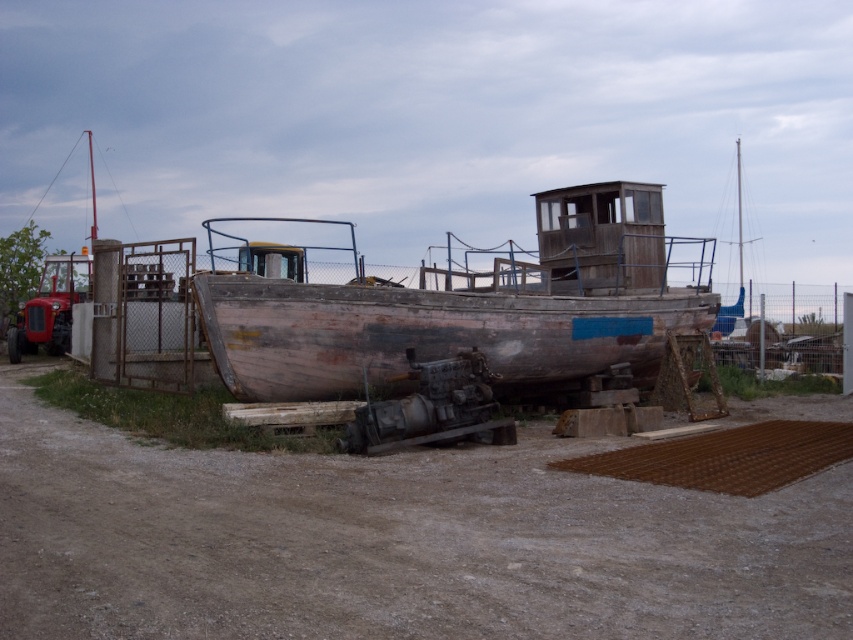
Question: Is brown dirt track at center below rusty wood boat at center?

Choices:
 (A) yes
 (B) no

Answer: (A)

Question: Is brown dirt track at center smaller than rusty wood boat at center?

Choices:
 (A) no
 (B) yes

Answer: (B)

Question: Is brown dirt track at center below rusty wood boat at center?

Choices:
 (A) yes
 (B) no

Answer: (A)

Question: Which point is closer to the camera?

Choices:
 (A) brown dirt track at center
 (B) rusty wood boat at center

Answer: (A)

Question: Which object is closer to the camera taking this photo?

Choices:
 (A) rusty wood boat at center
 (B) brown dirt track at center

Answer: (B)